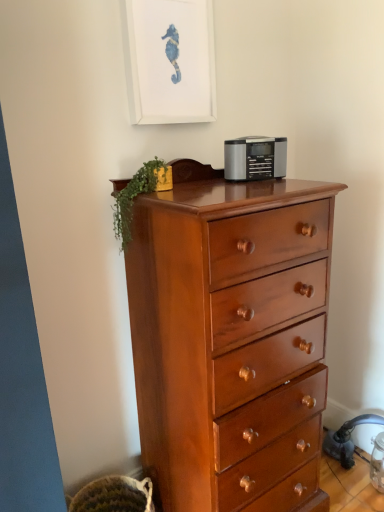
Question: From a real-world perspective, is green leafy plant at upper left on white matte picture frame at upper center?

Choices:
 (A) no
 (B) yes

Answer: (A)

Question: Does green leafy plant at upper left have a larger size compared to white matte picture frame at upper center?

Choices:
 (A) no
 (B) yes

Answer: (A)

Question: Is green leafy plant at upper left shorter than white matte picture frame at upper center?

Choices:
 (A) yes
 (B) no

Answer: (A)

Question: From a real-world perspective, is green leafy plant at upper left positioned under white matte picture frame at upper center based on gravity?

Choices:
 (A) yes
 (B) no

Answer: (A)

Question: Is white matte picture frame at upper center located within green leafy plant at upper left?

Choices:
 (A) no
 (B) yes

Answer: (A)

Question: Is green leafy plant at upper left closer to the viewer compared to white matte picture frame at upper center?

Choices:
 (A) yes
 (B) no

Answer: (A)

Question: Would you say white matte picture frame at upper center contains satin silver radio at center?

Choices:
 (A) no
 (B) yes

Answer: (A)

Question: From a real-world perspective, is white matte picture frame at upper center on satin silver radio at center?

Choices:
 (A) yes
 (B) no

Answer: (A)

Question: Is white matte picture frame at upper center completely or partially outside of satin silver radio at center?

Choices:
 (A) yes
 (B) no

Answer: (A)

Question: From the image's perspective, does white matte picture frame at upper center appear lower than satin silver radio at center?

Choices:
 (A) yes
 (B) no

Answer: (B)

Question: From a real-world perspective, does white matte picture frame at upper center sit lower than satin silver radio at center?

Choices:
 (A) no
 (B) yes

Answer: (A)

Question: Is there a large distance between white matte picture frame at upper center and satin silver radio at center?

Choices:
 (A) yes
 (B) no

Answer: (B)

Question: Is green leafy plant at upper left wider than shiny brown wooden chest of drawers at center?

Choices:
 (A) no
 (B) yes

Answer: (A)